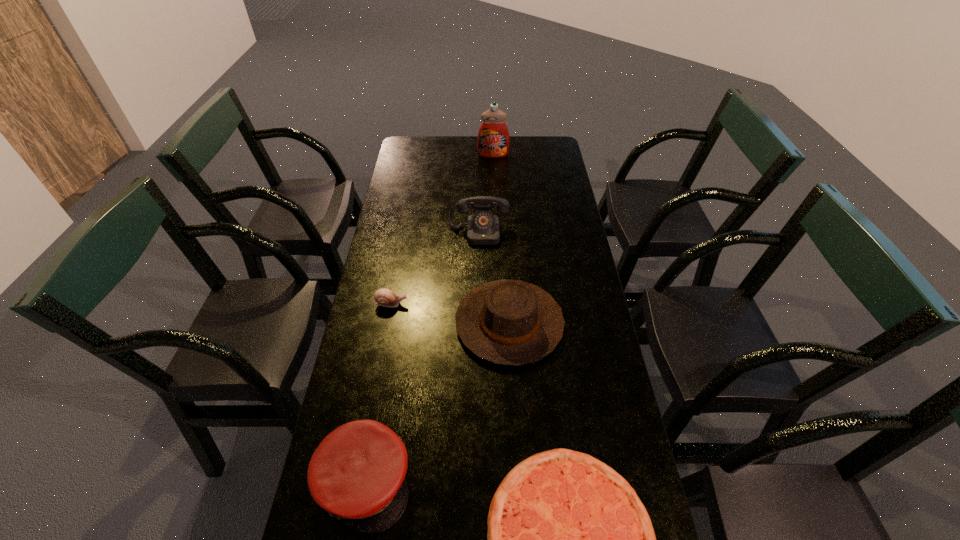
The width and height of the screenshot is (960, 540). In order to click on vacant space in between the second farthest object and the cap in this screenshot , I will do (x=421, y=357).

You are a GUI agent. You are given a task and a screenshot of the screen. Output one action in this format:
    pyautogui.click(x=<x>, y=<y>)
    Task: Click on the free space between the tallest object and the telephone
    The width and height of the screenshot is (960, 540).
    Given the screenshot: What is the action you would take?
    pyautogui.click(x=486, y=194)

The height and width of the screenshot is (540, 960). What are the coordinates of `free space between the escargot and the cowboy hat` in the screenshot? It's located at (450, 313).

At what (x,y) coordinates should I click in order to perform the action: click on free space between the farthest object and the escargot. Please return your answer as a coordinate pair (x, y). Looking at the image, I should click on (443, 230).

At what (x,y) coordinates should I click in order to perform the action: click on vacant region between the detergent and the escargot. Please return your answer as a coordinate pair (x, y). Looking at the image, I should click on (443, 230).

Identify the location of vacant space that is in between the fifth nearest object and the cap. (421, 357).

Identify which object is located as the nearest to the cap. Please provide its 2D coordinates. Your answer should be formatted as a tuple, i.e. [(x, y)], where the tuple contains the x and y coordinates of a point satisfying the conditions above.

[(568, 539)]

Identify which object is located as the third nearest to the detergent. Please provide its 2D coordinates. Your answer should be formatted as a tuple, i.e. [(x, y)], where the tuple contains the x and y coordinates of a point satisfying the conditions above.

[(384, 297)]

At what (x,y) coordinates should I click in order to perform the action: click on vacant space that satisfies the following two spatial constraints: 1. on the front-facing side of the escargot; 2. on the back side of the cowboy hat. Please return your answer as a coordinate pair (x, y). Looking at the image, I should click on (388, 323).

This screenshot has height=540, width=960. In order to click on vacant point that satisfies the following two spatial constraints: 1. on the dial of the second farthest object; 2. at the front of the cap where the visor is located in this screenshot , I will do coord(478,482).